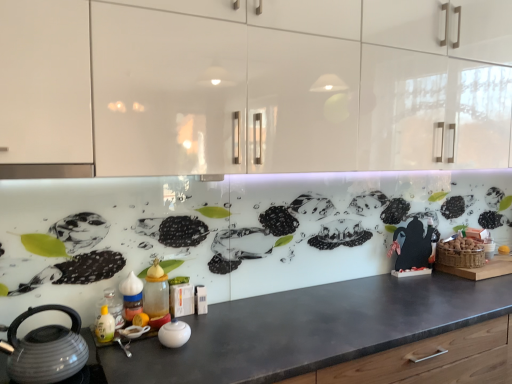
Question: Which direction should I rotate to face translucent glass bottle at center, which appears as the third bottle when viewed from the left, — up or down?

Choices:
 (A) up
 (B) down

Answer: (B)

Question: Is white glossy bowl at center to the right of translucent plastic bottle at lower left, the third bottle in the right-to-left sequence, from the viewer's perspective?

Choices:
 (A) no
 (B) yes

Answer: (B)

Question: Is white glossy bowl at center turned away from translucent plastic bottle at lower left, which is counted as the first bottle, starting from the left?

Choices:
 (A) yes
 (B) no

Answer: (B)

Question: Does white glossy bowl at center have a lesser width compared to translucent plastic bottle at lower left, the third bottle in the right-to-left sequence?

Choices:
 (A) yes
 (B) no

Answer: (A)

Question: Does white glossy bowl at center come in front of translucent plastic bottle at lower left, which is counted as the first bottle, starting from the left?

Choices:
 (A) no
 (B) yes

Answer: (B)

Question: Considering the relative sizes of white glossy bowl at center and translucent plastic bottle at lower left, the third bottle in the right-to-left sequence, in the image provided, is white glossy bowl at center bigger than translucent plastic bottle at lower left, the third bottle in the right-to-left sequence,?

Choices:
 (A) yes
 (B) no

Answer: (B)

Question: Is the position of white glossy bowl at center more distant than that of translucent plastic bottle at lower left, the third bottle in the right-to-left sequence?

Choices:
 (A) yes
 (B) no

Answer: (B)

Question: Is white glossy bowl at center far away from translucent glass bottle at center, which appears as the third bottle when viewed from the left?

Choices:
 (A) no
 (B) yes

Answer: (A)

Question: Is white glossy bowl at center positioned in front of translucent glass bottle at center, which appears as the third bottle when viewed from the left?

Choices:
 (A) no
 (B) yes

Answer: (B)

Question: Is white glossy bowl at center further to the viewer compared to translucent glass bottle at center, which is counted as the first bottle, starting from the right?

Choices:
 (A) yes
 (B) no

Answer: (B)

Question: Can you confirm if white glossy bowl at center is bigger than translucent glass bottle at center, which is counted as the first bottle, starting from the right?

Choices:
 (A) no
 (B) yes

Answer: (A)

Question: Is white glossy bowl at center surrounding translucent glass bottle at center, which is counted as the first bottle, starting from the right?

Choices:
 (A) yes
 (B) no

Answer: (B)

Question: Is translucent glass bottle at center, which is counted as the first bottle, starting from the right, at the back of white glossy bowl at center?

Choices:
 (A) no
 (B) yes

Answer: (B)

Question: Is translucent plastic spice jar at center, the 2th bottle when ordered from right to left, in contact with white glossy cabinets at upper center?

Choices:
 (A) no
 (B) yes

Answer: (A)